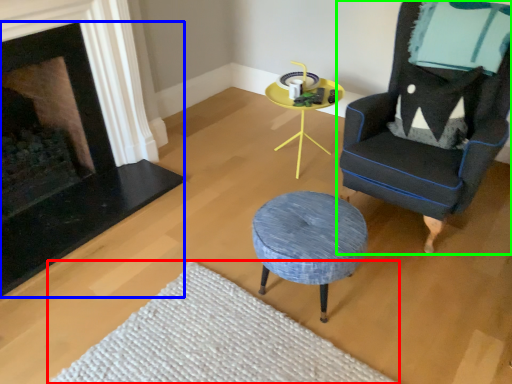
Question: Based on their relative distances, which object is nearer to plain (highlighted by a red box)? Choose from fireplace (highlighted by a blue box) and chair (highlighted by a green box).

Choices:
 (A) fireplace
 (B) chair

Answer: (A)